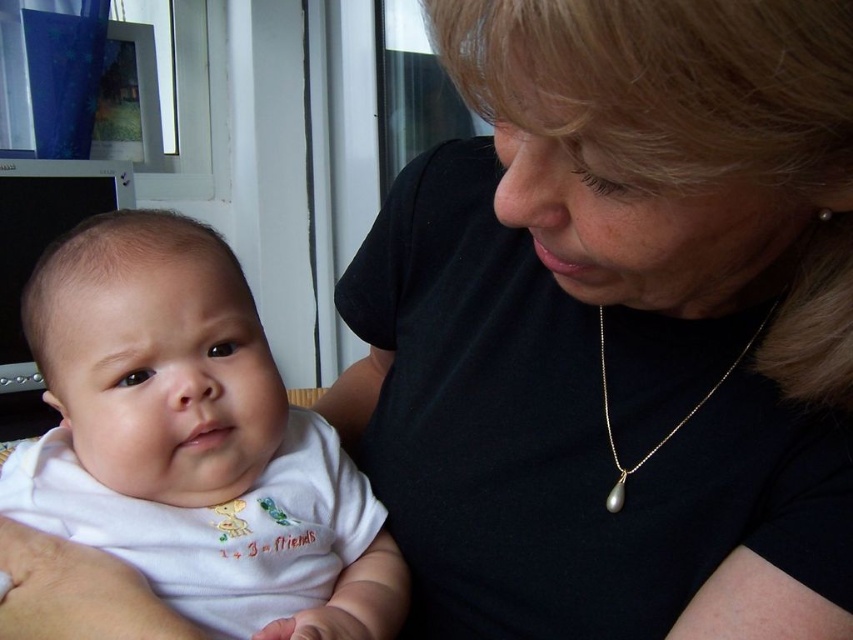
Which of these two, black matte shirt at center or white soft fabric baby at center, stands shorter?

With less height is white soft fabric baby at center.

Identify the location of black matte shirt at center. The width and height of the screenshot is (853, 640). (618, 326).

You are a GUI agent. You are given a task and a screenshot of the screen. Output one action in this format:
    pyautogui.click(x=<x>, y=<y>)
    Task: Click on the black matte shirt at center
    Image resolution: width=853 pixels, height=640 pixels.
    Given the screenshot: What is the action you would take?
    pyautogui.click(x=618, y=326)

Between white soft fabric baby at center and gold pearl necklace at lower center, which one appears on the left side from the viewer's perspective?

From the viewer's perspective, white soft fabric baby at center appears more on the left side.

Between white soft fabric baby at center and gold pearl necklace at lower center, which one has less height?

gold pearl necklace at lower center is shorter.

Who is more forward, [131,218] or [622,476]?

Point [622,476] is more forward.

Identify the location of white soft fabric baby at center. The height and width of the screenshot is (640, 853). (190, 396).

Where is `black matte shirt at center`? black matte shirt at center is located at coordinates (618, 326).

The image size is (853, 640). Describe the element at coordinates (618, 326) in the screenshot. I see `black matte shirt at center` at that location.

Who is more distant from viewer, (566, 244) or (711, 385)?

Positioned behind is point (711, 385).

In order to click on black matte shirt at center in this screenshot , I will do `click(618, 326)`.